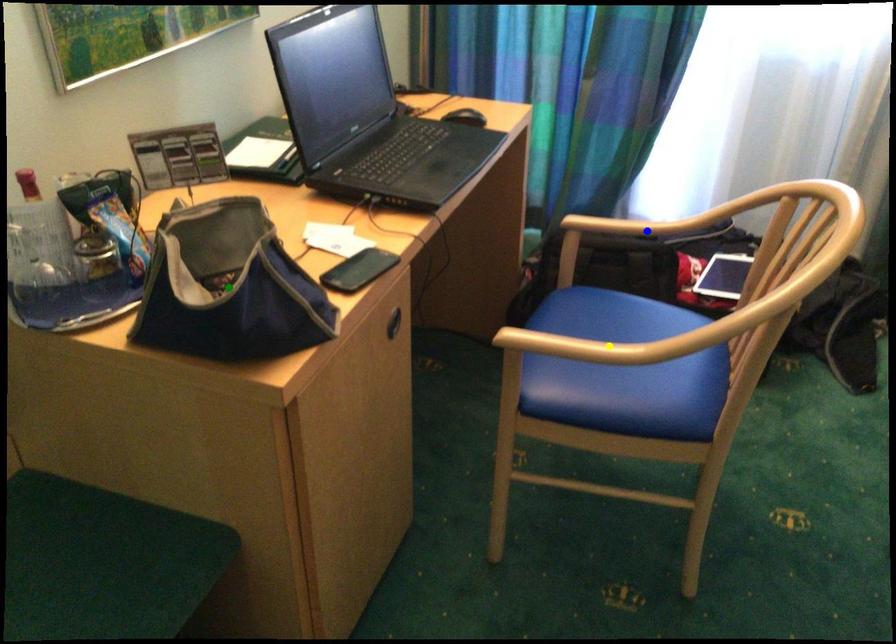
Order these from nearest to farthest:
green point | yellow point | blue point

green point → yellow point → blue point